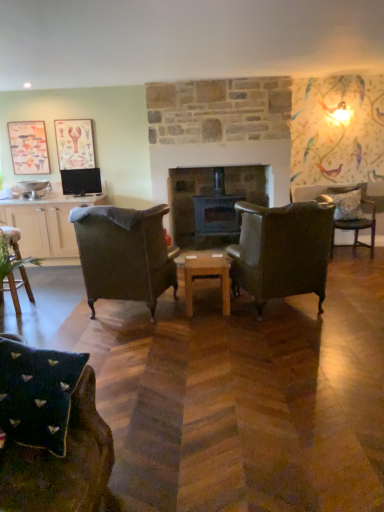
What do you see at coordinates (62, 463) in the screenshot? I see `velvet green armchair at lower left, positioned as the 4th chair in right-to-left order` at bounding box center [62, 463].

Where is `velvet green armchair at lower left, positioned as the 4th chair in right-to-left order`? This screenshot has height=512, width=384. velvet green armchair at lower left, positioned as the 4th chair in right-to-left order is located at coordinates point(62,463).

From a real-world perspective, does dark green fabric armchair at center, positioned as the 3th chair in left-to-right order, sit lower than leather armchair at center, placed as the fourth chair when sorted from back to front?

No, from a real-world perspective, dark green fabric armchair at center, positioned as the 3th chair in left-to-right order, is not under leather armchair at center, placed as the fourth chair when sorted from back to front.

Is dark green fabric armchair at center, positioned as the 3th chair in left-to-right order, behind leather armchair at center, which appears as the second chair when viewed from the front?

That is True.

Between dark green fabric armchair at center, marked as the third chair in a front-to-back arrangement, and leather armchair at center, which ranks as the 2th chair in right-to-left order, which one appears on the left side from the viewer's perspective?

Positioned to the left is dark green fabric armchair at center, marked as the third chair in a front-to-back arrangement.

Is dark green fabric armchair at center, which is counted as the 3th chair, starting from the back, located outside leather armchair at center, which ranks as the 2th chair in right-to-left order?

Yes, dark green fabric armchair at center, which is counted as the 3th chair, starting from the back, is located beyond the bounds of leather armchair at center, which ranks as the 2th chair in right-to-left order.

From a real-world perspective, is wooden chair at lower left, which is counted as the 1th chair, starting from the left, located higher than velvet green armchair at lower left, which appears as the 1th chair when viewed from the front?

Actually, wooden chair at lower left, which is counted as the 1th chair, starting from the left, is physically below velvet green armchair at lower left, which appears as the 1th chair when viewed from the front, in the real world.

Considering the sizes of objects wooden chair at lower left, which is counted as the 1th chair, starting from the left, and velvet green armchair at lower left, positioned as the 4th chair in right-to-left order, in the image provided, who is smaller, wooden chair at lower left, which is counted as the 1th chair, starting from the left, or velvet green armchair at lower left, positioned as the 4th chair in right-to-left order,?

wooden chair at lower left, which is counted as the 1th chair, starting from the left.

Does point (18, 285) appear closer or farther from the camera than point (105, 428)?

Point (18, 285).

Consider the image. Does matte white cabinet at left come in front of leather armchair at center, acting as the fourth chair starting from the left?

That is False.

Is matte white cabinet at left not near leather armchair at center, which appears as the second chair when viewed from the front?

Absolutely, matte white cabinet at left is distant from leather armchair at center, which appears as the second chair when viewed from the front.

From the image's perspective, would you say matte white cabinet at left is shown under leather armchair at center, acting as the fourth chair starting from the left?

No.

Is wooden at center at the left side of dark gray stone fireplace at center?

Yes.

Is wooden at center outside of dark gray stone fireplace at center?

wooden at center is positioned outside dark gray stone fireplace at center.

Does point (203, 255) appear closer or farther from the camera than point (179, 202)?

Point (203, 255) is closer to the camera than point (179, 202).

Can you tell me how much wooden at center and dark gray stone fireplace at center differ in facing direction?

There is a 177-degree angle between the facing directions of wooden at center and dark gray stone fireplace at center.

Is floral-patterned fabric chair at right, positioned as the first chair in back-to-front order, wider than leather armchair at center, which appears as the second chair when viewed from the front?

No.

Is floral-patterned fabric chair at right, which ranks as the fifth chair in left-to-right order, touching leather armchair at center, acting as the fourth chair starting from the left?

No, floral-patterned fabric chair at right, which ranks as the fifth chair in left-to-right order, is not in contact with leather armchair at center, acting as the fourth chair starting from the left.

How far apart are floral-patterned fabric chair at right, which ranks as the fifth chair in left-to-right order, and leather armchair at center, acting as the fourth chair starting from the left?

floral-patterned fabric chair at right, which ranks as the fifth chair in left-to-right order, and leather armchair at center, acting as the fourth chair starting from the left, are 6.89 feet apart.

Is point (365, 236) closer or farther from the camera than point (279, 241)?

Point (365, 236).

Between matte black tv at left and matte paper picture frame at upper left, the second picture frame positioned from the left, which one has smaller width?

matte paper picture frame at upper left, the second picture frame positioned from the left, is thinner.

Which object is further away from the camera, matte black tv at left or matte paper picture frame at upper left, the 1th picture frame when ordered from right to left?

matte paper picture frame at upper left, the 1th picture frame when ordered from right to left, is behind.

Is point (84, 185) less distant than point (72, 139)?

No, (84, 185) is further to viewer.

From the image's perspective, is matte black tv at left above or below matte paper picture frame at upper left, the 1th picture frame when ordered from right to left?

Clearly, from the image's perspective, matte black tv at left is below matte paper picture frame at upper left, the 1th picture frame when ordered from right to left.

Would you consider dark gray stone fireplace at center to be distant from wooden at center?

That's right, there is a large distance between dark gray stone fireplace at center and wooden at center.

From the image's perspective, is dark gray stone fireplace at center below wooden at center?

Incorrect, from the image's perspective, dark gray stone fireplace at center is higher than wooden at center.

Would you say dark gray stone fireplace at center is inside or outside wooden at center?

dark gray stone fireplace at center lies outside wooden at center.

Is dark gray stone fireplace at center to the right of wooden at center from the viewer's perspective?

Correct, you'll find dark gray stone fireplace at center to the right of wooden at center.

Identify the location of the 1st chair behind the leather armchair at center, which appears as the second chair when viewed from the front. The image size is (384, 512). (124, 254).

Where is `the 3rd chair in front of the wooden chair at lower left, arranged as the second chair when viewed from the back, starting your count from the anchor`? the 3rd chair in front of the wooden chair at lower left, arranged as the second chair when viewed from the back, starting your count from the anchor is located at coordinates (62, 463).

Based on their spatial positions, is velvet green armchair at lower left, which appears as the 1th chair when viewed from the front, or floral-patterned fabric chair at right, positioned as the first chair in back-to-front order, closer to leather armchair at center, acting as the fourth chair starting from the left?

floral-patterned fabric chair at right, positioned as the first chair in back-to-front order, is closer to leather armchair at center, acting as the fourth chair starting from the left.

From the image, which object appears to be nearer to matte white cabinet at left, matte black tv at left or floral-patterned fabric chair at right, which appears as the 1th chair when viewed from the right?

matte black tv at left lies closer to matte white cabinet at left than the other object.

From the image, which object appears to be nearer to dark gray stone fireplace at center, matte black tv at left or matte white cabinet at left?

Based on the image, matte black tv at left appears to be nearer to dark gray stone fireplace at center.

From the picture: Looking at the image, which one is located further to wooden chair at lower left, positioned as the fourth chair in front-to-back order, matte paper picture frame at upper left, the 1th picture frame when ordered from right to left, or matte wooden picture frame at upper left, the second picture frame positioned from the right?

matte wooden picture frame at upper left, the second picture frame positioned from the right, lies further to wooden chair at lower left, positioned as the fourth chair in front-to-back order, than the other object.

Based on their spatial positions, is dark green fabric armchair at center, positioned as the 3th chair in left-to-right order, or dark gray stone fireplace at center closer to matte black tv at left?

The object closer to matte black tv at left is dark gray stone fireplace at center.

Looking at the image, which one is located closer to dark green fabric armchair at center, marked as the third chair in a front-to-back arrangement, matte paper picture frame at upper left, the second picture frame positioned from the left, or wooden at center?

The object closer to dark green fabric armchair at center, marked as the third chair in a front-to-back arrangement, is wooden at center.

In the scene shown: When comparing their distances from leather armchair at center, which ranks as the 2th chair in right-to-left order, does wooden chair at lower left, arranged as the second chair when viewed from the back, or wooden at center seem further?

wooden chair at lower left, arranged as the second chair when viewed from the back, lies further to leather armchair at center, which ranks as the 2th chair in right-to-left order, than the other object.

Considering their positions, is white textured pillow at right positioned further to matte black tv at left than dark green fabric armchair at center, which is counted as the 3th chair, starting from the back?

white textured pillow at right is further to matte black tv at left.

Locate an element on the screen. The image size is (384, 512). television between matte white cabinet at left and white textured pillow at right is located at coordinates (81, 181).

Find the location of `picture frame between matte wooden picture frame at upper left, the first picture frame in the left-to-right sequence, and dark gray stone fireplace at center, in the horizontal direction`. picture frame between matte wooden picture frame at upper left, the first picture frame in the left-to-right sequence, and dark gray stone fireplace at center, in the horizontal direction is located at coordinates (74, 144).

Where is `cabinetry between wooden chair at lower left, which is counted as the 1th chair, starting from the left, and matte black tv at left, along the z-axis`? cabinetry between wooden chair at lower left, which is counted as the 1th chair, starting from the left, and matte black tv at left, along the z-axis is located at coordinates (45, 224).

This screenshot has height=512, width=384. Find the location of `fireplace situated between matte wooden picture frame at upper left, the first picture frame in the left-to-right sequence, and leather armchair at center, placed as the fourth chair when sorted from back to front, from left to right`. fireplace situated between matte wooden picture frame at upper left, the first picture frame in the left-to-right sequence, and leather armchair at center, placed as the fourth chair when sorted from back to front, from left to right is located at coordinates (212, 201).